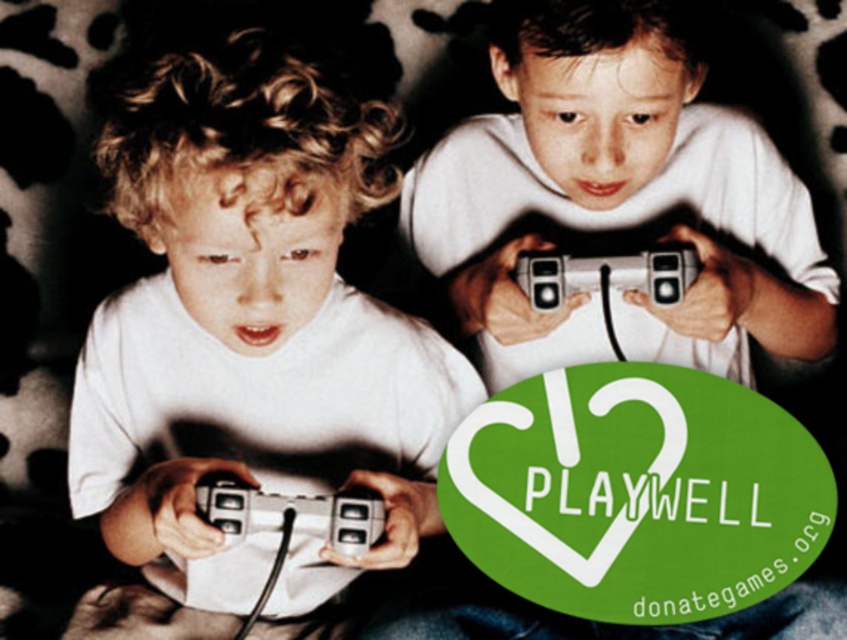
Question: Which of these objects is positioned farthest from the silver metallic controller at center?

Choices:
 (A) matte white shirt at center
 (B) metallic silver game controller at lower center

Answer: (A)

Question: Which object is farther from the camera taking this photo?

Choices:
 (A) metallic silver game controller at lower center
 (B) silver metallic controller at center

Answer: (B)

Question: Does matte white shirt at center have a greater width compared to metallic silver game controller at lower center?

Choices:
 (A) yes
 (B) no

Answer: (A)

Question: Can you confirm if matte white shirt at center is wider than silver metallic controller at center?

Choices:
 (A) no
 (B) yes

Answer: (B)

Question: From the image, what is the correct spatial relationship of metallic silver game controller at lower center in relation to silver metallic controller at center?

Choices:
 (A) right
 (B) left

Answer: (B)

Question: Which of the following is the closest to the observer?

Choices:
 (A) (535, 253)
 (B) (374, 433)

Answer: (A)